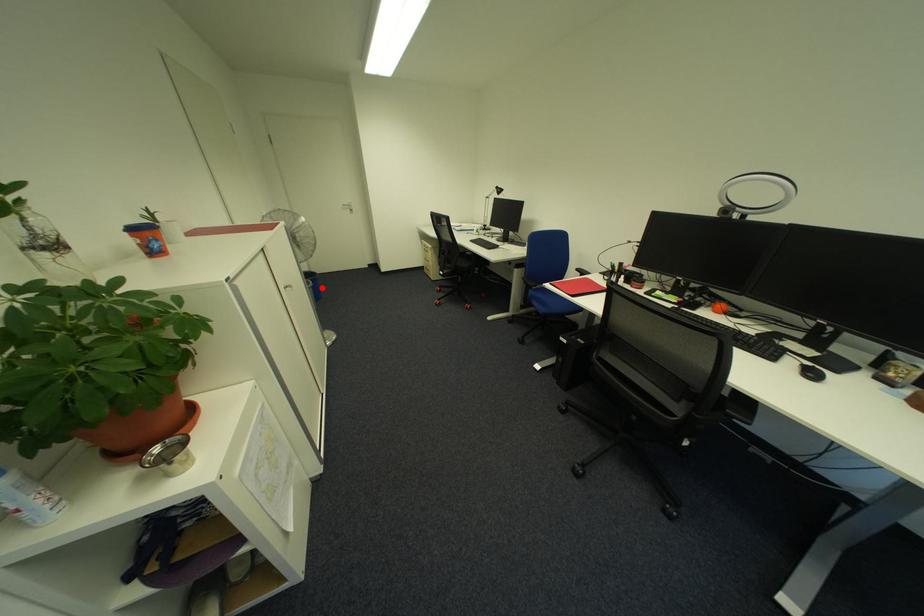
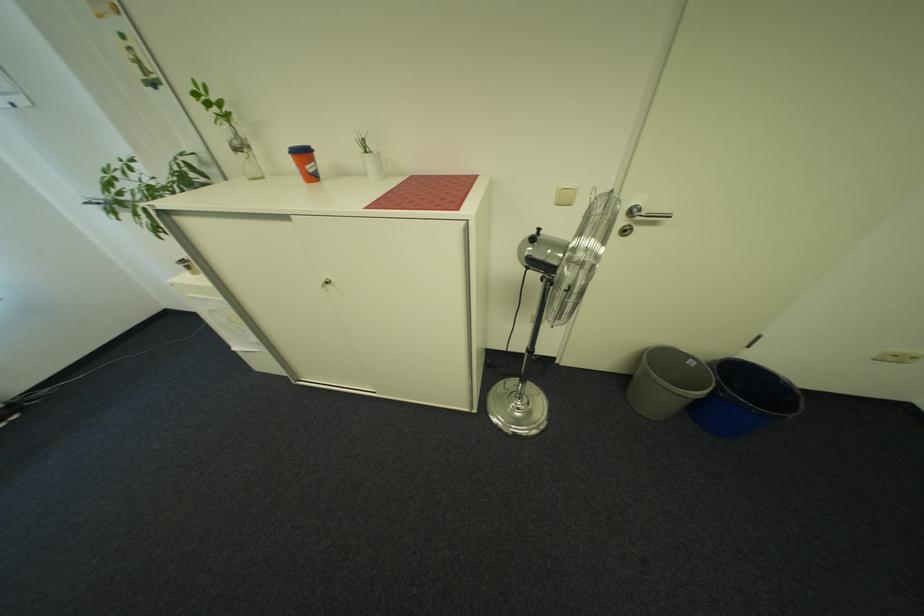
Question: A red point is marked in image1. In image2, is the corresponding 3D point closer to the camera or farther? Reply with the corresponding letter.

Choices:
 (A) The corresponding 3D point is closer.
 (B) The corresponding 3D point is farther.

Answer: (B)